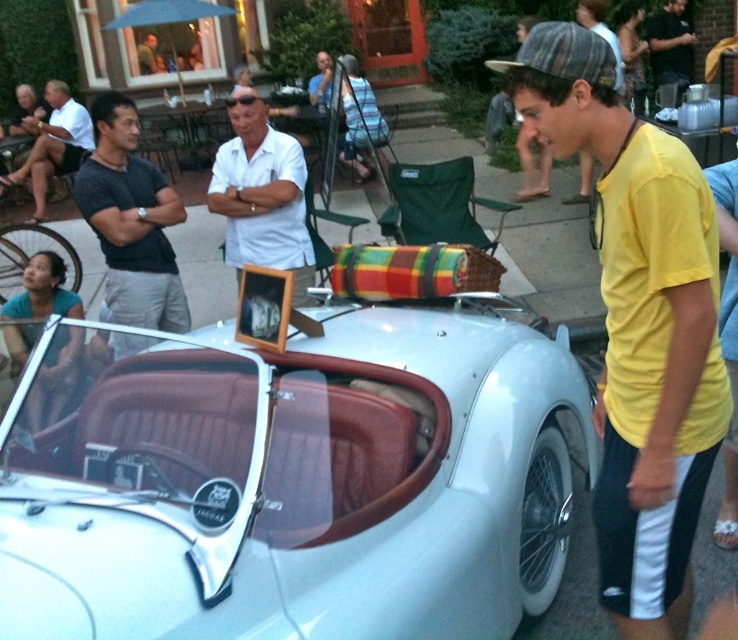
Which is more to the right, silver metallic car at center or dark gray fabric shirt at left?

Positioned to the right is silver metallic car at center.

Image resolution: width=738 pixels, height=640 pixels. Identify the location of silver metallic car at center. (289, 484).

Is point (556, 524) behind point (125, 307)?

No.

Where is `silver metallic car at center`? silver metallic car at center is located at coordinates (289, 484).

Locate an element on the screen. Image resolution: width=738 pixels, height=640 pixels. yellow cotton shirt at center is located at coordinates (638, 324).

Identify the location of yellow cotton shirt at center. The width and height of the screenshot is (738, 640). (638, 324).

This screenshot has height=640, width=738. I want to click on silver metallic car at center, so [x=289, y=484].

Looking at this image, between silver metallic car at center and white cotton shirt at upper left, which one has more height?

With more height is white cotton shirt at upper left.

The width and height of the screenshot is (738, 640). What are the coordinates of `silver metallic car at center` in the screenshot? It's located at (289, 484).

The width and height of the screenshot is (738, 640). Identify the location of silver metallic car at center. (289, 484).